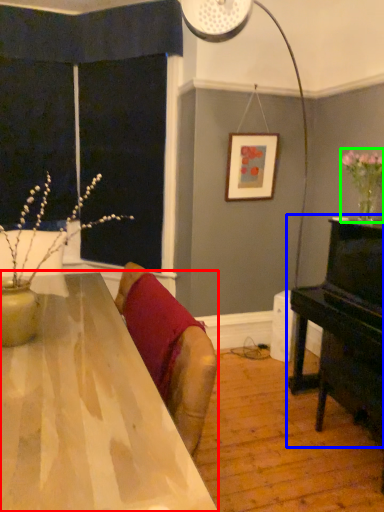
Question: Considering the real-world distances, which object is farthest from table (highlighted by a red box)? piano (highlighted by a blue box) or floral arrangement (highlighted by a green box)?

Choices:
 (A) piano
 (B) floral arrangement

Answer: (B)